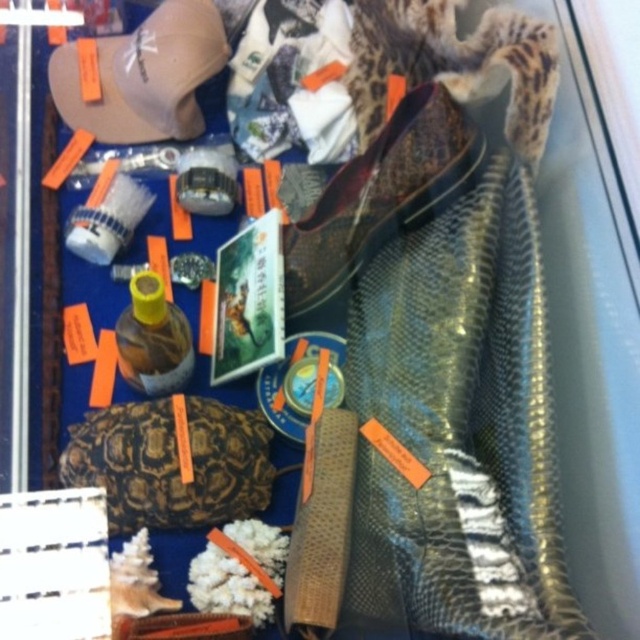
Can you confirm if leather shoe at center is positioned below yellow matte bottle at center-left?

Incorrect, leather shoe at center is not positioned below yellow matte bottle at center-left.

Which of these two, leather shoe at center or yellow matte bottle at center-left, stands shorter?

yellow matte bottle at center-left

Which is behind, point (353, 243) or point (132, 369)?

Positioned behind is point (353, 243).

Find the location of a particular element. leather shoe at center is located at coordinates (380, 195).

Between leather-textured purse at center and leather shoe at center, which one is positioned lower?

leather-textured purse at center is lower down.

Can you confirm if leather-textured purse at center is positioned to the left of leather shoe at center?

Indeed, leather-textured purse at center is positioned on the left side of leather shoe at center.

Is point (220, 452) closer to viewer compared to point (429, 150)?

No, it is behind (429, 150).

You are a GUI agent. You are given a task and a screenshot of the screen. Output one action in this format:
    pyautogui.click(x=<x>, y=<y>)
    Task: Click on the leather-textured purse at center
    The height and width of the screenshot is (640, 640).
    Given the screenshot: What is the action you would take?
    pyautogui.click(x=172, y=461)

Consider the image. Who is more distant from viewer, (465, 116) or (138, 122)?

Positioned behind is point (138, 122).

Is leather shoe at center to the right of beige fabric baseball cap at upper left from the viewer's perspective?

Yes, leather shoe at center is to the right of beige fabric baseball cap at upper left.

Who is more forward, [420,104] or [154,93]?

Positioned in front is point [420,104].

At what (x,y) coordinates should I click in order to perform the action: click on leather shoe at center. Please return your answer as a coordinate pair (x, y). The width and height of the screenshot is (640, 640). Looking at the image, I should click on (380, 195).